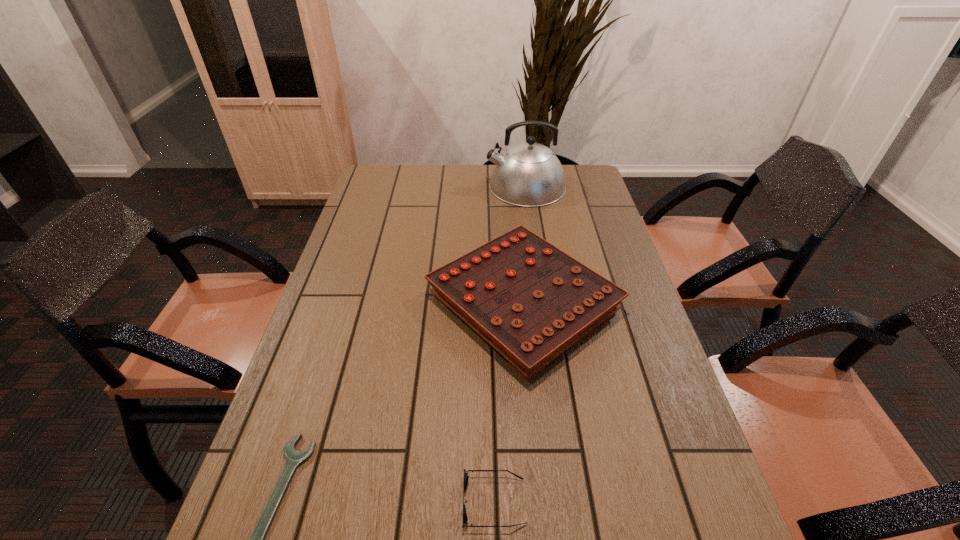
Where is `vacant space located 0.190m on the front-facing side of the sunglasses`? The height and width of the screenshot is (540, 960). vacant space located 0.190m on the front-facing side of the sunglasses is located at coordinates (363, 502).

Find the location of `free space located 0.280m on the front-facing side of the sunglasses`. free space located 0.280m on the front-facing side of the sunglasses is located at coordinates (315, 502).

In order to click on object positioned at the far edge in this screenshot , I will do `click(529, 174)`.

You are a GUI agent. You are given a task and a screenshot of the screen. Output one action in this format:
    pyautogui.click(x=<x>, y=<y>)
    Task: Click on the kettle present at the right edge
    
    Given the screenshot: What is the action you would take?
    pyautogui.click(x=529, y=174)

Where is `gameboard that is positioned at the right edge`? This screenshot has width=960, height=540. gameboard that is positioned at the right edge is located at coordinates (529, 300).

You are a GUI agent. You are given a task and a screenshot of the screen. Output one action in this format:
    pyautogui.click(x=<x>, y=<y>)
    Task: Click on the object situated at the far right corner
    Image resolution: width=960 pixels, height=540 pixels.
    Given the screenshot: What is the action you would take?
    pyautogui.click(x=529, y=174)

Locate an element on the screen. Image resolution: width=960 pixels, height=540 pixels. vacant space at the far edge of the desktop is located at coordinates (433, 176).

What are the coordinates of `free space at the right edge` in the screenshot? It's located at (578, 256).

At what (x,y) coordinates should I click in order to perform the action: click on vacant space at the far left corner of the desktop. Please return your answer as a coordinate pair (x, y). Looking at the image, I should click on (371, 190).

Where is `vacant point located between the second shortest object and the second farthest object`? vacant point located between the second shortest object and the second farthest object is located at coordinates (509, 402).